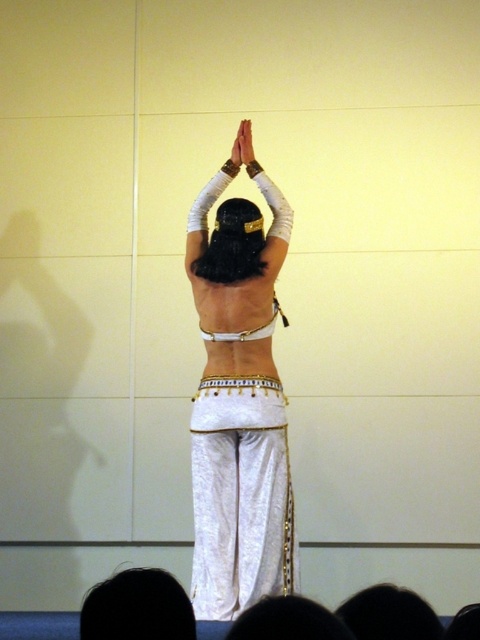
Does dark hair at center appear over white satin bikini top at center?

No.

From the picture: Does dark hair at center lie behind white satin bikini top at center?

No, dark hair at center is in front of white satin bikini top at center.

The height and width of the screenshot is (640, 480). I want to click on dark hair at center, so click(288, 620).

Between white matte arm at upper center and white matte hand at upper center, which one is positioned lower?

Positioned lower is white matte arm at upper center.

Between white matte arm at upper center and white matte hand at upper center, which one is positioned higher?

white matte hand at upper center is above.

At what (x,y) coordinates should I click in order to perform the action: click on white matte arm at upper center. Please return your answer as a coordinate pair (x, y). This screenshot has width=480, height=640. Looking at the image, I should click on (204, 225).

The image size is (480, 640). Find the location of `white matte arm at upper center`. white matte arm at upper center is located at coordinates (204, 225).

The width and height of the screenshot is (480, 640). Identify the location of white matte arm at upper center. (204, 225).

Between point (189, 272) and point (223, 336), which one is positioned in front?

Positioned in front is point (223, 336).

Between point (190, 216) and point (235, 333), which one is positioned in front?

Positioned in front is point (235, 333).

Where is `white matte arm at upper center`? Image resolution: width=480 pixels, height=640 pixels. white matte arm at upper center is located at coordinates (204, 225).